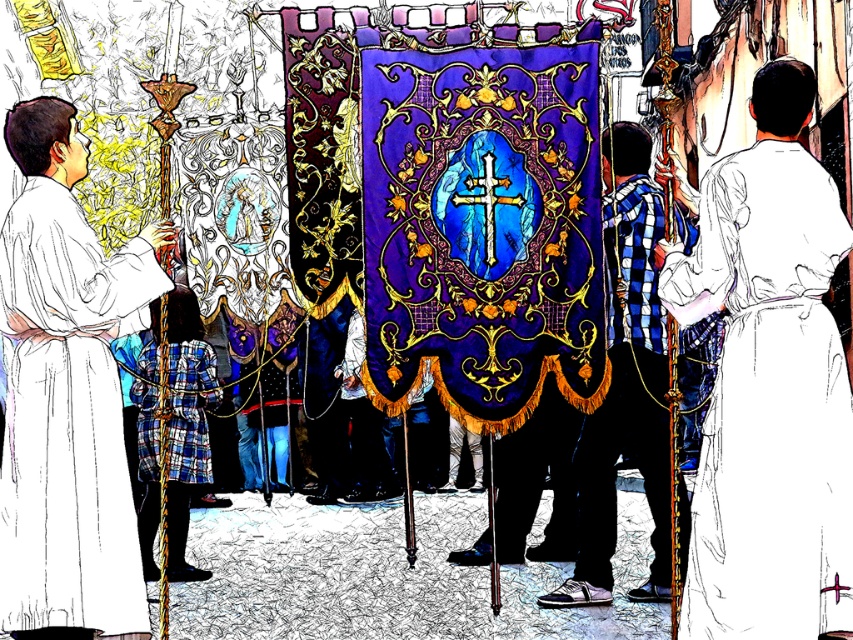
Question: Can you confirm if blue plaid shirt at center is positioned to the left of plaid fabric robe at center?

Choices:
 (A) yes
 (B) no

Answer: (B)

Question: Which point is farther to the camera?

Choices:
 (A) pos(625,429)
 (B) pos(820,323)
 (C) pos(155,570)

Answer: (C)

Question: Is white cloth robe at right positioned in front of blue plaid shirt at center?

Choices:
 (A) no
 (B) yes

Answer: (B)

Question: Which point is closer to the camera taking this photo?

Choices:
 (A) (604, 182)
 (B) (759, 312)
 (C) (202, 417)

Answer: (B)

Question: Does white cloth robe at left come behind plaid fabric robe at center?

Choices:
 (A) yes
 (B) no

Answer: (B)

Question: Estimate the real-world distances between objects in this image. Which object is closer to the white cloth robe at right?

Choices:
 (A) white cloth robe at left
 (B) plaid fabric robe at center
 (C) blue plaid shirt at center

Answer: (C)